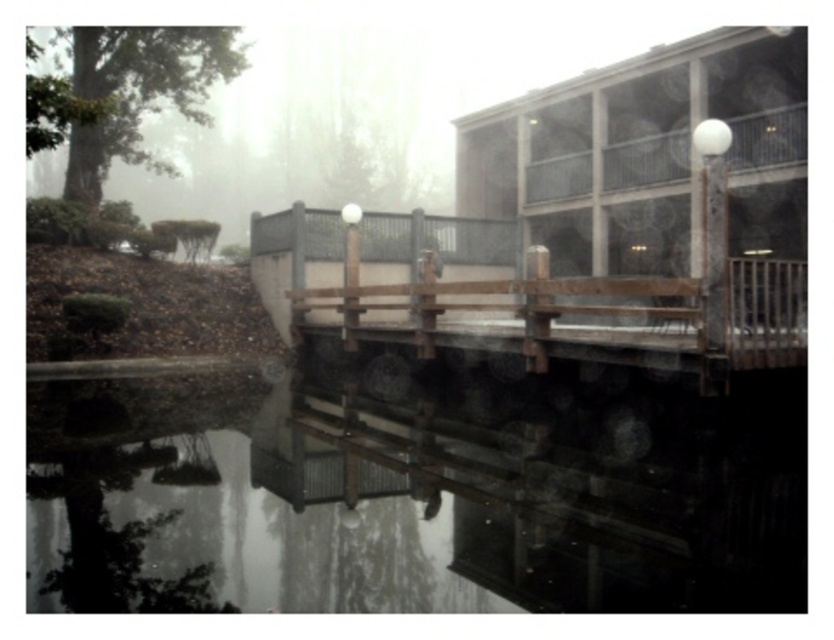
Question: Among these objects, which one is farthest from the camera?

Choices:
 (A) transparent water at center
 (B) wooden bench at center

Answer: (B)

Question: From the image, what is the correct spatial relationship of transparent water at center in relation to wooden bench at center?

Choices:
 (A) right
 (B) left

Answer: (B)

Question: Is transparent water at center behind wooden bench at center?

Choices:
 (A) no
 (B) yes

Answer: (A)

Question: Is transparent water at center to the left of wooden bench at center from the viewer's perspective?

Choices:
 (A) no
 (B) yes

Answer: (B)